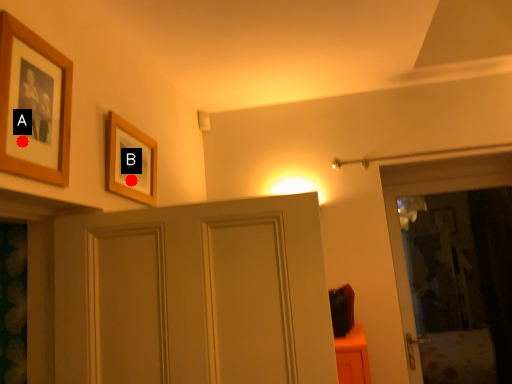
Question: Two points are circled on the image, labeled by A and B beside each circle. Which of the following is the farthest from the observer?

Choices:
 (A) A is further
 (B) B is further

Answer: (B)